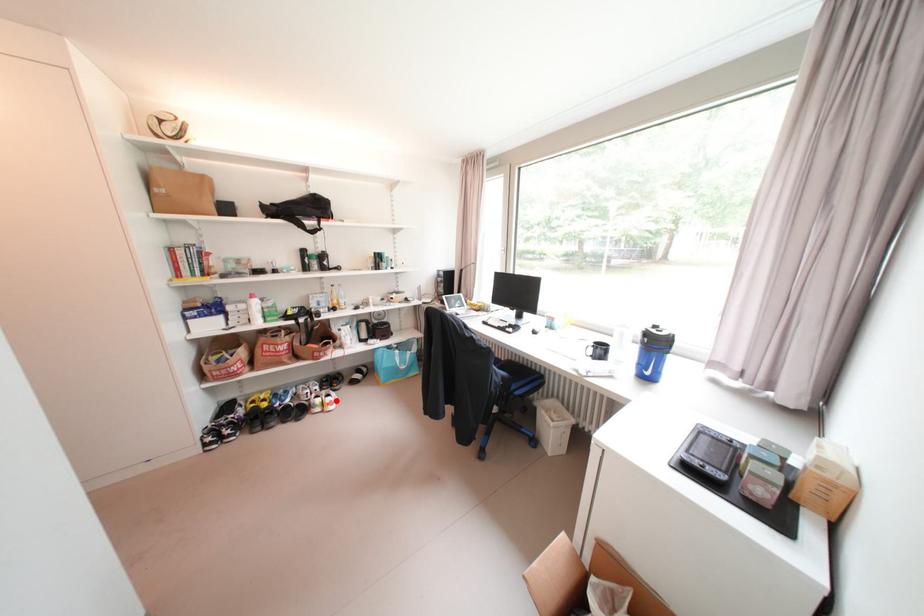
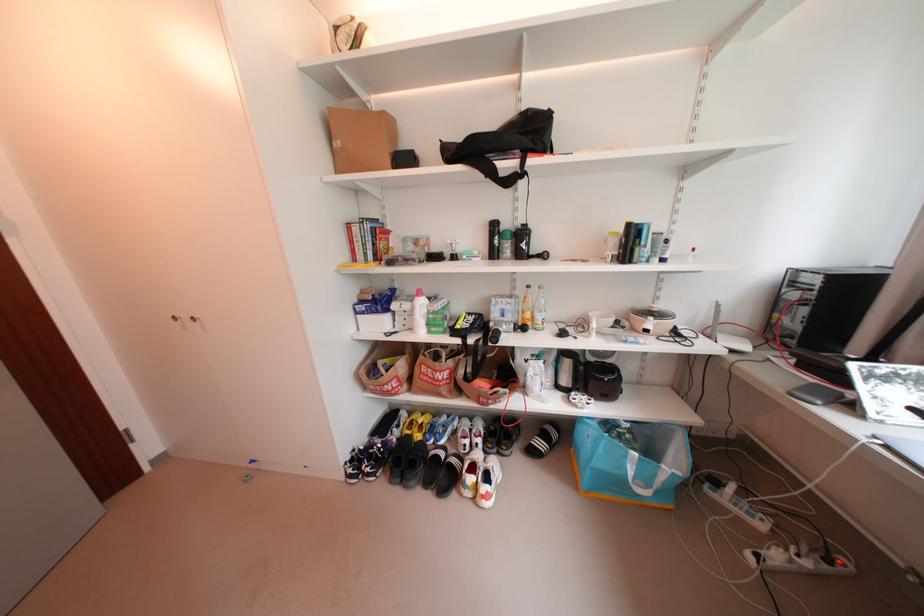
The point at the highlighted location is marked in the first image. Where is the corresponding point in the second image?

(492, 488)